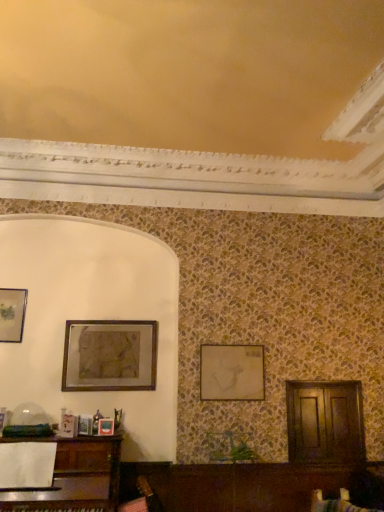
Question: From the image's perspective, is wooden framed artwork at upper left, which is the 2th picture frame from right to left, above or below matte gold picture frame at upper left, arranged as the third picture frame when viewed from the right?

Choices:
 (A) below
 (B) above

Answer: (A)

Question: Is wooden framed artwork at upper left, acting as the second picture frame starting from the left, to the left or to the right of matte gold picture frame at upper left, which is counted as the first picture frame, starting from the left, in the image?

Choices:
 (A) right
 (B) left

Answer: (A)

Question: Which of these objects is positioned farthest from the wooden framed artwork at upper left, which is the 2th picture frame from right to left?

Choices:
 (A) matte gold picture frame at center, positioned as the first picture frame in right-to-left order
 (B) matte gold picture frame at upper left, arranged as the third picture frame when viewed from the right

Answer: (A)

Question: Which object is the closest to the wooden framed artwork at upper left, which is the 2th picture frame from right to left?

Choices:
 (A) matte gold picture frame at upper left, which is counted as the first picture frame, starting from the left
 (B) matte gold picture frame at center, positioned as the third picture frame in left-to-right order

Answer: (A)